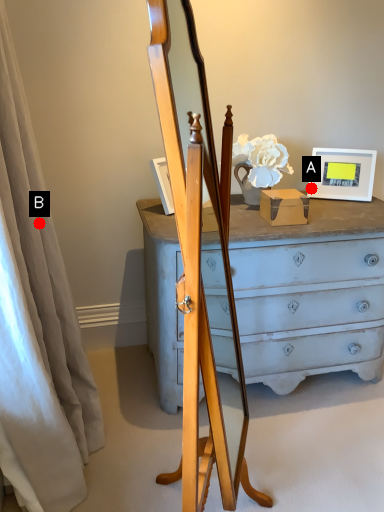
Question: Two points are circled on the image, labeled by A and B beside each circle. Which point is closer to the camera?

Choices:
 (A) A is closer
 (B) B is closer

Answer: (B)